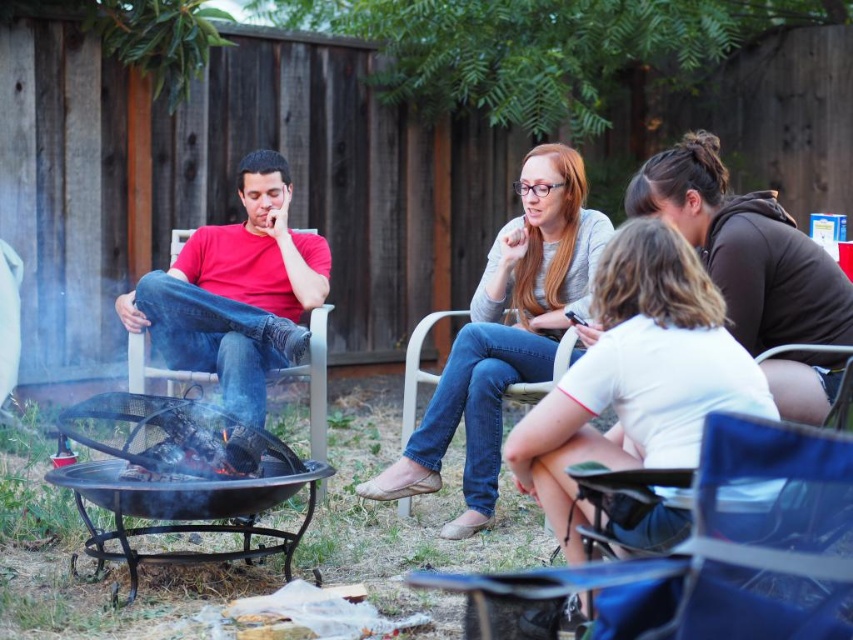
You are standing in the backyard looking at the fire pit area. There are two points marked in the scene, one at coordinates point (308,506) and another at point (224,372). Which of these two points is nearer to your current position?

Point (308,506) is closer to the camera than point (224,372), so the point at coordinates point (308,506) is nearer to your current position.